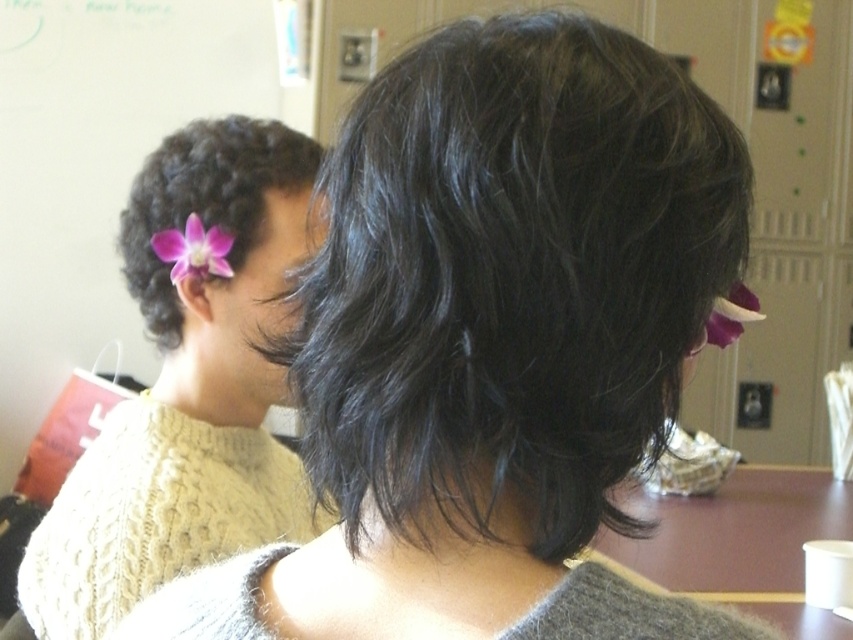
Consider the image. Which is more to the right, purple matte flower at left or purple matte flower at upper right?

Positioned to the right is purple matte flower at upper right.

Does point (223, 218) come behind point (735, 307)?

Yes, it is behind point (735, 307).

The image size is (853, 640). What do you see at coordinates (204, 198) in the screenshot? I see `purple matte flower at left` at bounding box center [204, 198].

Find the location of a particular element. purple matte flower at left is located at coordinates (204, 198).

Does pink flower at left appear on the left side of purple matte flower at upper left?

Incorrect, pink flower at left is not on the left side of purple matte flower at upper left.

Is point (225, 352) more distant than point (202, 250)?

Yes, it is.

Does point (160, 388) come farther from viewer compared to point (215, 253)?

That is True.

Locate an element on the screen. Image resolution: width=853 pixels, height=640 pixels. pink flower at left is located at coordinates (187, 388).

Between pink flower at left and purple matte flower at left, which one is positioned higher?

Positioned higher is purple matte flower at left.

Measure the distance between pink flower at left and purple matte flower at left.

They are 2.93 inches apart.

Describe the element at coordinates (187, 388) in the screenshot. I see `pink flower at left` at that location.

Identify the location of pink flower at left. This screenshot has height=640, width=853. (187, 388).